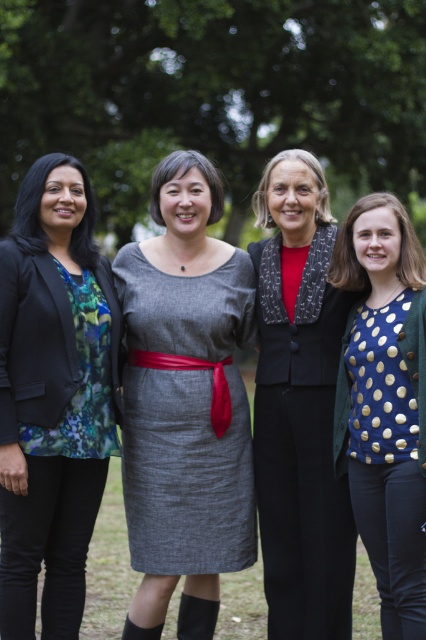
You are a photographer setting up for a group photo. You notice the matte black blazer at center and the gray woolen dress at center in the scene. Which clothing item is positioned higher on the person wearing them?

The matte black blazer at center is above the gray woolen dress at center, so the blazer is positioned higher on the person wearing them.

You are standing at the origin point of the coordinate system. You want to walk towards the gray woolen dress at center. In which direction should you head?

The gray woolen dress at center is located at coordinate point 0.741 on the x axis and 0.437 on the y axis. Since you are at the origin, you should move towards the positive x and positive y direction to reach the gray woolen dress at center.